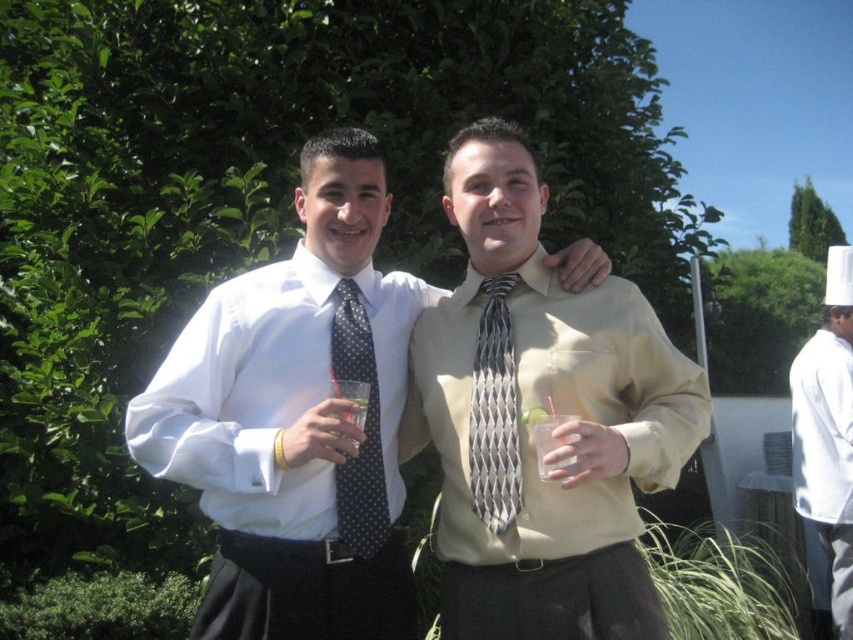
Can you confirm if white chef hat at upper right is smaller than clear glass at center?

No, white chef hat at upper right is not smaller than clear glass at center.

Does point (838, 552) lie behind point (347, 417)?

Yes, it is behind point (347, 417).

The width and height of the screenshot is (853, 640). Describe the element at coordinates (827, 433) in the screenshot. I see `white chef hat at upper right` at that location.

The width and height of the screenshot is (853, 640). Find the location of `white chef hat at upper right`. white chef hat at upper right is located at coordinates (827, 433).

What do you see at coordinates (363, 429) in the screenshot? This screenshot has width=853, height=640. I see `polka dot silk tie at center` at bounding box center [363, 429].

Identify the location of polka dot silk tie at center. The height and width of the screenshot is (640, 853). (363, 429).

Find the location of a particular element. polka dot silk tie at center is located at coordinates (x=363, y=429).

Identify the location of polka dot silk tie at center. Image resolution: width=853 pixels, height=640 pixels. (363, 429).

Based on the photo, who is taller, white glossy shirt at center or silver metallic tie at center?

white glossy shirt at center is taller.

Is white glossy shirt at center taller than silver metallic tie at center?

Indeed, white glossy shirt at center has a greater height compared to silver metallic tie at center.

I want to click on white glossy shirt at center, so click(x=296, y=419).